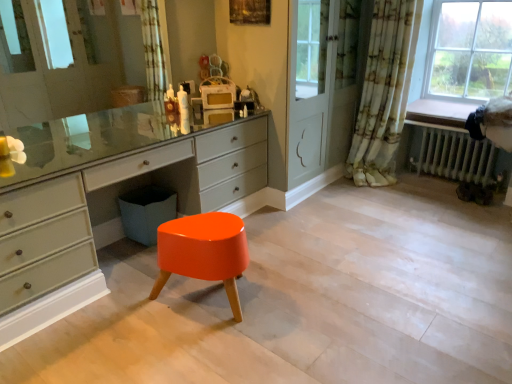
You are a GUI agent. You are given a task and a screenshot of the screen. Output one action in this format:
    pyautogui.click(x=<x>, y=<y>)
    Task: Click on the free spot to the left of glossy orange stool at center
    
    Given the screenshot: What is the action you would take?
    pyautogui.click(x=122, y=314)